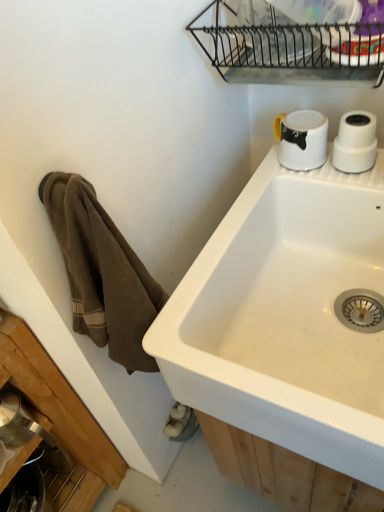
Describe the element at coordinates (294, 40) in the screenshot. I see `metallic wire rack at upper center` at that location.

Image resolution: width=384 pixels, height=512 pixels. What do you see at coordinates (302, 139) in the screenshot? I see `white glossy mug at upper right` at bounding box center [302, 139].

Where is `white ceramic sink at upper right`? white ceramic sink at upper right is located at coordinates (286, 317).

You are a GUI agent. You are given a task and a screenshot of the screen. Output one action in this format:
    pyautogui.click(x=<x>, y=<y>)
    Task: Click on the metallic wire rack at upper center
    The height and width of the screenshot is (512, 384).
    Given the screenshot: What is the action you would take?
    pyautogui.click(x=294, y=40)

From the picture: Which object is thinner, white ceramic sink at upper right or metallic wire rack at upper center?

With smaller width is metallic wire rack at upper center.

From their relative heights in the image, would you say white ceramic sink at upper right is taller or shorter than metallic wire rack at upper center?

Considering their sizes, white ceramic sink at upper right has more height than metallic wire rack at upper center.

Consider the image. Looking at the image, does white ceramic sink at upper right seem bigger or smaller compared to metallic wire rack at upper center?

Clearly, white ceramic sink at upper right is larger in size than metallic wire rack at upper center.

Considering the points (362, 478) and (275, 5), which point is in front, point (362, 478) or point (275, 5)?

Point (362, 478)

Visually, is white glossy mug at upper right positioned to the left or to the right of white ceramic sink at upper right?

white glossy mug at upper right is positioned on white ceramic sink at upper right's left side.

Is point (285, 138) in front of point (289, 176)?

Yes, point (285, 138) is closer to viewer.

Is white glossy mug at upper right positioned beyond the bounds of white ceramic sink at upper right?

Yes, white glossy mug at upper right is outside of white ceramic sink at upper right.

Is white glossy mug at upper right positioned with its back to white ceramic sink at upper right?

white glossy mug at upper right is not turned away from white ceramic sink at upper right.

From a real-world perspective, which object stands above the other?

From a 3D spatial view, white glossy mug at upper right is above.

Consider the image. Can you confirm if white ceramic sink at upper right is taller than white glossy mug at upper right?

Yes, white ceramic sink at upper right is taller than white glossy mug at upper right.

From the image's perspective, which one is positioned lower, white ceramic sink at upper right or white glossy mug at upper right?

white ceramic sink at upper right.

This screenshot has height=512, width=384. In the image, there is a white ceramic sink at upper right. In order to click on coffee cup above it (from the image's perspective) in this screenshot , I will do `click(302, 139)`.

Does metallic wire rack at upper center have a smaller size compared to white glossy mug at upper right?

Actually, metallic wire rack at upper center might be larger than white glossy mug at upper right.

Is metallic wire rack at upper center oriented away from white glossy mug at upper right?

That's not correct — metallic wire rack at upper center is not looking away from white glossy mug at upper right.

Identify the location of coffee cup that appears behind the metallic wire rack at upper center. (302, 139).

Is metallic wire rack at upper center not inside white glossy mug at upper right?

Yes, metallic wire rack at upper center is outside of white glossy mug at upper right.

Is white glossy mug at upper right located outside metallic wire rack at upper center?

Yes.

Between white glossy mug at upper right and metallic wire rack at upper center, which one has larger size?

With larger size is metallic wire rack at upper center.

Does point (279, 120) appear closer or farther from the camera than point (330, 55)?

Point (279, 120) is farther from the camera than point (330, 55).

Is metallic wire rack at upper center wider than white ceramic sink at upper right?

Incorrect, the width of metallic wire rack at upper center does not surpass that of white ceramic sink at upper right.

Who is shorter, metallic wire rack at upper center or white ceramic sink at upper right?

Standing shorter between the two is metallic wire rack at upper center.

From a real-world perspective, is metallic wire rack at upper center above or below white ceramic sink at upper right?

From a real-world perspective, metallic wire rack at upper center is physically above white ceramic sink at upper right.

Is metallic wire rack at upper center directly adjacent to white ceramic sink at upper right?

No, metallic wire rack at upper center is not beside white ceramic sink at upper right.

Where is `appliance above the white ceramic sink at upper right (from a real-world perspective)`? appliance above the white ceramic sink at upper right (from a real-world perspective) is located at coordinates (294, 40).

Locate an element on the screen. sink that appears in front of the white glossy mug at upper right is located at coordinates (286, 317).

Looking at the image, which one is located further to white ceramic sink at upper right, white glossy mug at upper right or metallic wire rack at upper center?

The object further to white ceramic sink at upper right is metallic wire rack at upper center.

Consider the image. Which object lies further to the anchor point white glossy mug at upper right, metallic wire rack at upper center or white ceramic sink at upper right?

white ceramic sink at upper right is positioned further to the anchor white glossy mug at upper right.

Looking at the image, which one is located further to metallic wire rack at upper center, white ceramic sink at upper right or white glossy mug at upper right?

Among the two, white ceramic sink at upper right is located further to metallic wire rack at upper center.

From the image, which object appears to be farther from metallic wire rack at upper center, white glossy mug at upper right or white ceramic sink at upper right?

white ceramic sink at upper right lies further to metallic wire rack at upper center than the other object.

Considering their positions, is white ceramic sink at upper right positioned further to white glossy mug at upper right than metallic wire rack at upper center?

white ceramic sink at upper right.

Looking at the image, which one is located closer to white ceramic sink at upper right, metallic wire rack at upper center or white glossy mug at upper right?

The object closer to white ceramic sink at upper right is white glossy mug at upper right.

The image size is (384, 512). I want to click on coffee cup between metallic wire rack at upper center and white ceramic sink at upper right from top to bottom, so click(302, 139).